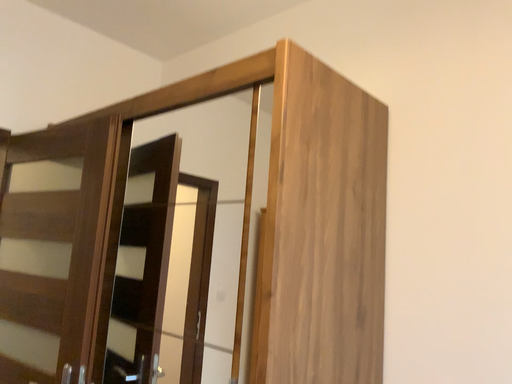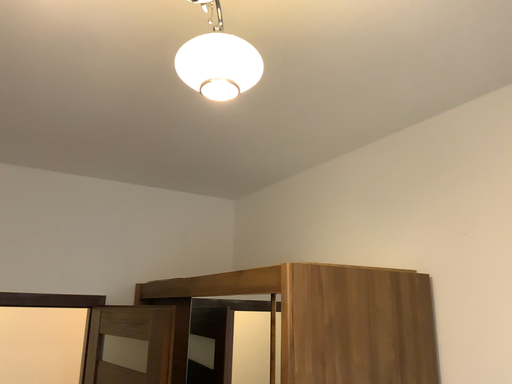
Question: How did the camera likely rotate when shooting the video?

Choices:
 (A) rotated upward
 (B) rotated downward

Answer: (A)